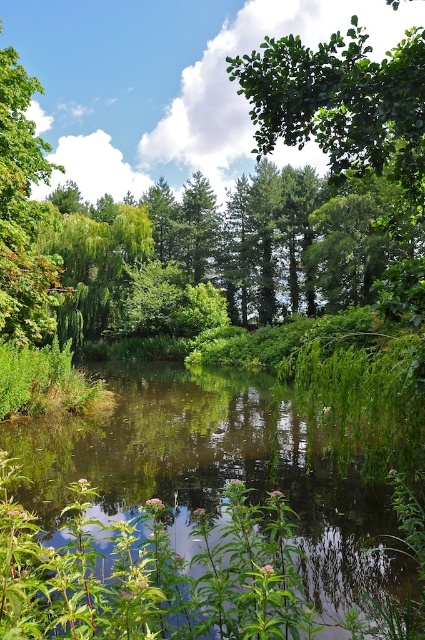
You are standing in the serene natural scene and want to take a photo of both the green leafy tree at upper center and the green leafy tree at upper left. Which tree should you focus on first to ensure both are in clear view?

You should focus on the green leafy tree at upper center first because it is closer to the viewer than the green leafy tree at upper left, so adjusting focus from near to far will help capture both clearly.

You are a park ranger planning to install a new bench between the green leafy tree at upper center and the green leafy tree at upper left. The bench requires a minimum of 10 meters of space between the two trees to be placed comfortably. Based on the scene, will there be enough space for the bench?

The green leafy tree at upper center and green leafy tree at upper left are 10.52 meters apart, which is more than the required 10 meters. Therefore, there is enough space to place the bench comfortably between them.

You are standing at the edge of the pond and notice the green leafy river at center and the green leafy tree at upper center. Which one appears shorter in height?

The green leafy river at center appears shorter in height than the green leafy tree at upper center because it is not as tall as the tree.